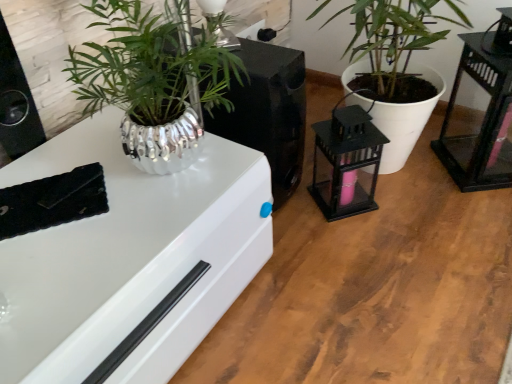
You are a GUI agent. You are given a task and a screenshot of the screen. Output one action in this format:
    pyautogui.click(x=<x>, y=<y>)
    Task: Click on the empty space that is in between black metal lantern at center-right, the first appliance in the right-to-left sequence, and black glass table at right
    
    Given the screenshot: What is the action you would take?
    pyautogui.click(x=415, y=183)